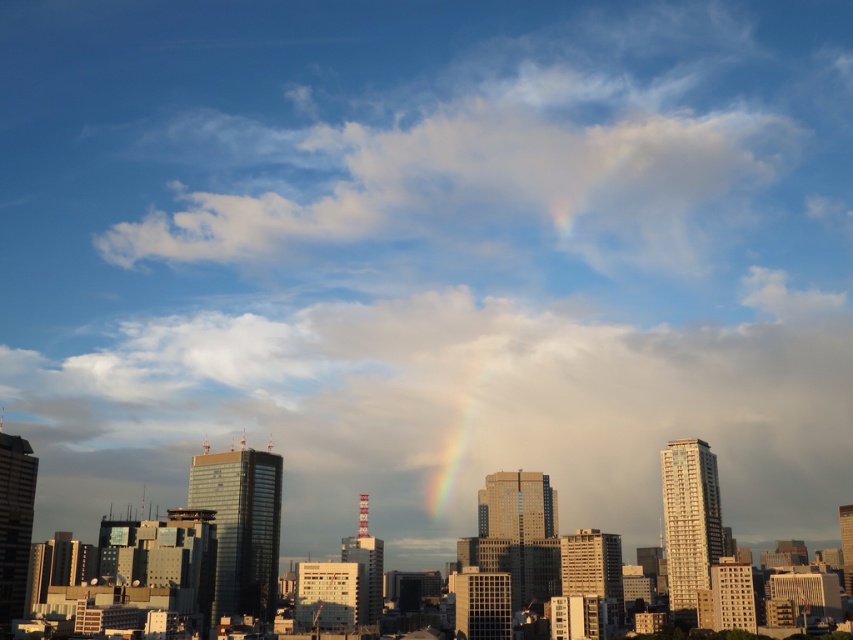
Consider the image. You are a drone operator planning to fly a drone between the cloudy sky at center and the rainbow at center. The drone has a maximum flight distance of 300 feet. Can the drone safely travel between these two points without exceeding its range?

The distance between the cloudy sky at center and the rainbow at center is 283.05 feet, which is within the drone operator maximum flight distance of 300 feet. Therefore, the drone can safely travel between these two points without exceeding its range.

You are an architect designing a new skyscraper and want to ensure it aligns with the cityscape in the image. Given the positions of the cloudy sky at center and the white fluffy cloud at upper center, which object should your building avoid blocking to maintain the view of the sky?

The cloudy sky at center is positioned on the left side of the white fluffy cloud at upper center. To maintain the view of the sky, the building should avoid blocking the cloudy sky at center as it is closer to the left side compared to the white fluffy cloud at upper center.

You are an urban planner analyzing the cityscape. You notice the cloudy sky at center and the rainbow at center. Which object is located above the other?

The rainbow at center is above the cloudy sky at center because the cloudy sky at center is positioned under it.